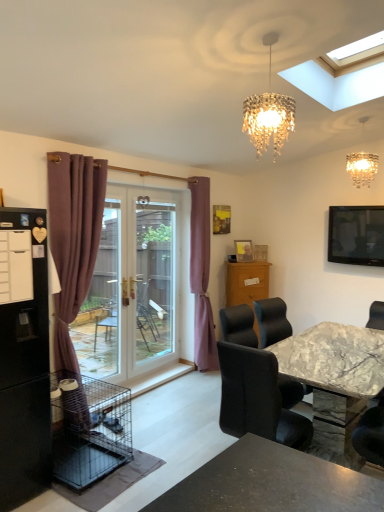
The image size is (384, 512). Identify the location of free region under wooden picture frame at center (from a real-world perspective). (242, 262).